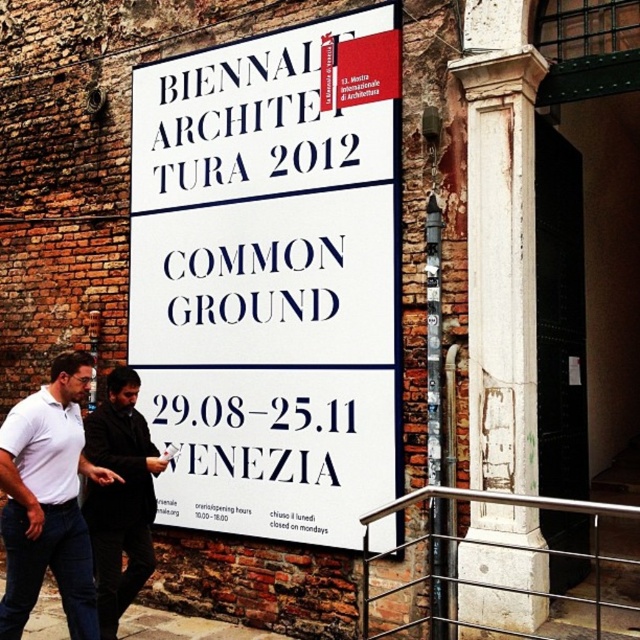
You are holding a measuring tape and need to determine if the distance between the white paper sign at center and the blue text at center is more than 17 inches. Based on the scene, what is your conclusion?

The white paper sign at center is 17.73 inches away from the blue text at center, so the distance is more than 17 inches.